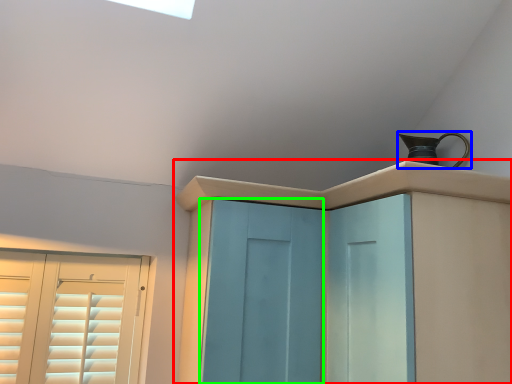
Question: Which object is the farthest from cupboard (highlighted by a red box)? Choose among these: jug (highlighted by a blue box) or screen door (highlighted by a green box).

Choices:
 (A) jug
 (B) screen door

Answer: (A)